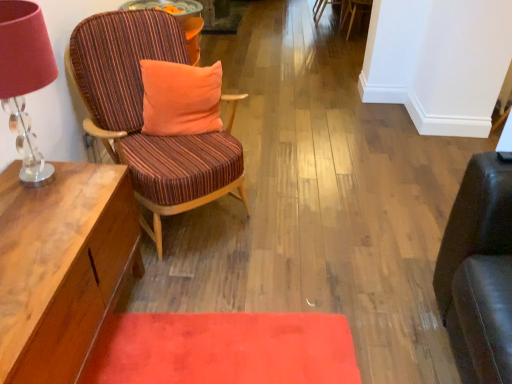
Question: Is striped fabric chair at left, the third chair when ordered from back to front, bigger than wooden side table at left?

Choices:
 (A) no
 (B) yes

Answer: (B)

Question: Is striped fabric chair at left, the 3th chair in the top-to-bottom sequence, shorter than wooden side table at left?

Choices:
 (A) no
 (B) yes

Answer: (A)

Question: Is striped fabric chair at left, which is the first chair from bottom to top, not within wooden side table at left?

Choices:
 (A) yes
 (B) no

Answer: (A)

Question: From a real-world perspective, is striped fabric chair at left, marked as the first chair in a left-to-right arrangement, below wooden side table at left?

Choices:
 (A) yes
 (B) no

Answer: (A)

Question: From the image's perspective, is striped fabric chair at left, the 3th chair in the top-to-bottom sequence, beneath wooden side table at left?

Choices:
 (A) no
 (B) yes

Answer: (B)

Question: Can you confirm if striped fabric chair at left, which is the first chair from bottom to top, is positioned to the left of wooden side table at left?

Choices:
 (A) yes
 (B) no

Answer: (B)

Question: Is translucent glass table lamp at left facing towards orange velvety pillow at center?

Choices:
 (A) no
 (B) yes

Answer: (A)

Question: Does translucent glass table lamp at left have a lesser width compared to orange velvety pillow at center?

Choices:
 (A) no
 (B) yes

Answer: (A)

Question: Is translucent glass table lamp at left touching orange velvety pillow at center?

Choices:
 (A) no
 (B) yes

Answer: (A)

Question: Is translucent glass table lamp at left far away from orange velvety pillow at center?

Choices:
 (A) no
 (B) yes

Answer: (A)

Question: Is translucent glass table lamp at left outside orange velvety pillow at center?

Choices:
 (A) yes
 (B) no

Answer: (A)

Question: Does translucent glass table lamp at left have a smaller size compared to orange velvety pillow at center?

Choices:
 (A) no
 (B) yes

Answer: (A)

Question: Is orange velvety pillow at center at the right side of striped fabric chair at left, the third chair viewed from the right?

Choices:
 (A) yes
 (B) no

Answer: (A)